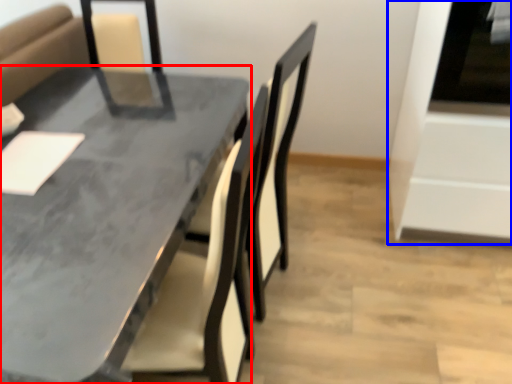
Question: Which object appears closest to the camera in this image, table (highlighted by a red box) or oven (highlighted by a blue box)?

Choices:
 (A) table
 (B) oven

Answer: (A)